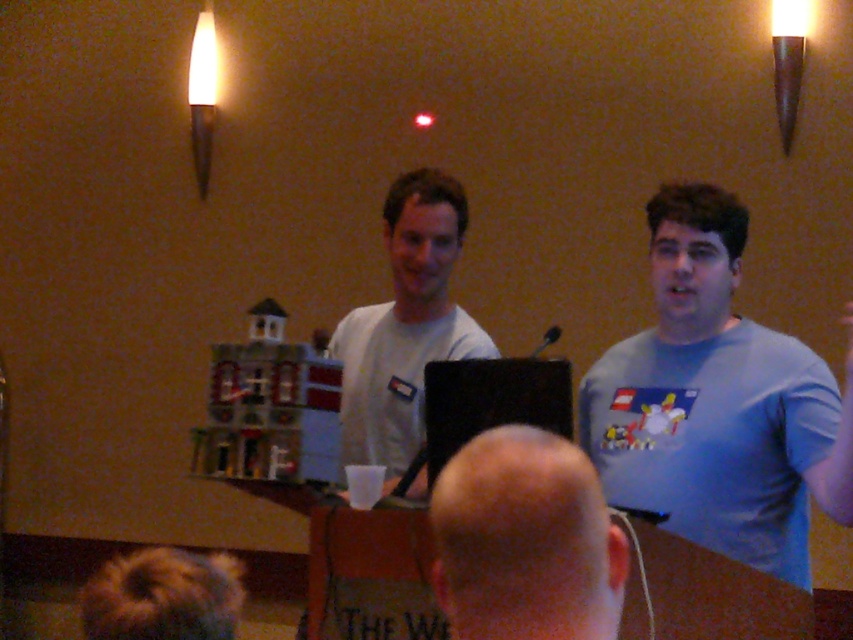
Question: Can you confirm if bald head at center is bigger than white matte t-shirt at center?

Choices:
 (A) yes
 (B) no

Answer: (B)

Question: Which point is closer to the camera taking this photo?

Choices:
 (A) tap(331, 353)
 (B) tap(611, 580)
 (C) tap(689, 525)

Answer: (B)

Question: Which point is farther from the camera taking this photo?

Choices:
 (A) (389, 492)
 (B) (677, 508)
 (C) (566, 573)

Answer: (A)

Question: Is bald head at center positioned before white matte t-shirt at center?

Choices:
 (A) yes
 (B) no

Answer: (A)

Question: Does bald head at center have a greater width compared to white matte t-shirt at center?

Choices:
 (A) no
 (B) yes

Answer: (A)

Question: Which object is the farthest from the blue cotton shirt at center?

Choices:
 (A) white matte t-shirt at center
 (B) bald head at center

Answer: (B)